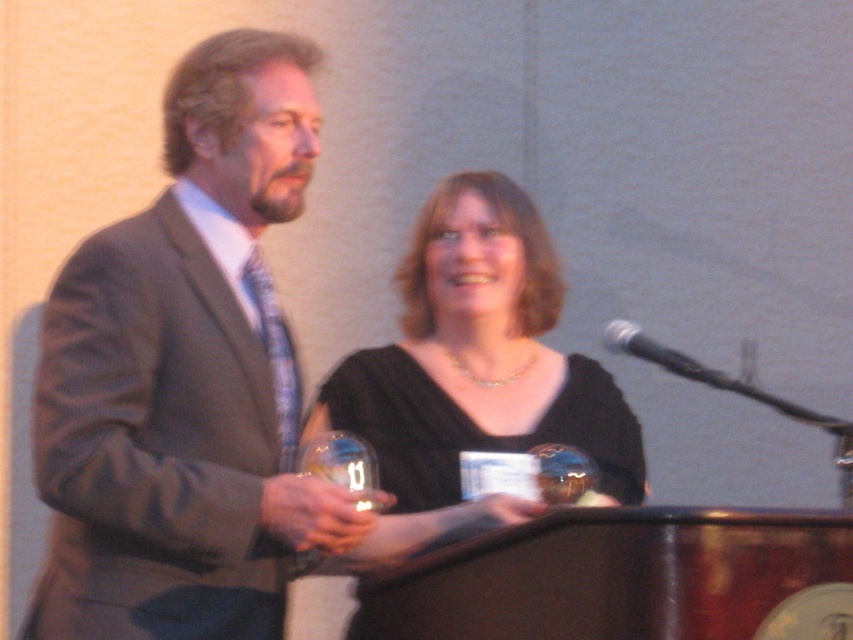
You are a photographer at an event and need to capture a photo of the gray suit at left and the black metallic microphone at center. From the photographer perspective, which object is closer to the left edge of the photo?

The gray suit at left is positioned on the left side of the black metallic microphone at center, so the gray suit at left is closer to the left edge of the photo.